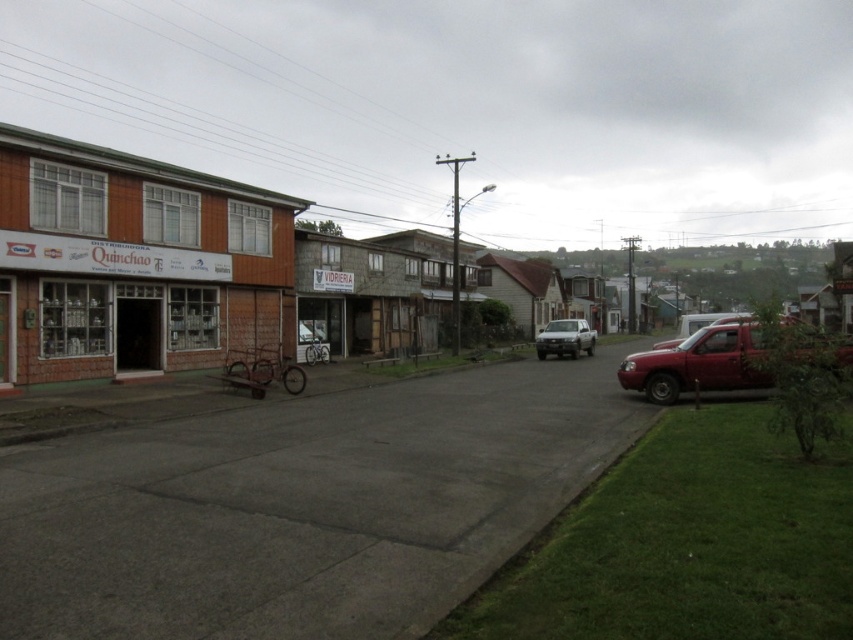
You are a delivery person who needs to park your van between the brown wooden store at left and the metallic red truck at right. Is there enough space between them to fit your van which is 6 meters long?

The brown wooden store at left is to the left of the metallic red truck at right, but the distance between them isn not specified in the objects description. Therefore, it is unclear if there is enough space to fit a 6 meter long van between them.

You are a delivery person who needs to park your van between the brown wooden store at left and the metallic red pickup truck at right. The van is 6 meters long. Can you fit your van between them?

The distance between the brown wooden store at left and the metallic red pickup truck at right is 15.36 meters. Since the van is 6 meters long, there is enough space to park it between them.

You are standing at the intersection of the quiet street and want to find the brown wooden store at left. According to the map coordinates, where should you look for it?

The brown wooden store at left is located at point (132, 262), so you should look in that direction on the map.